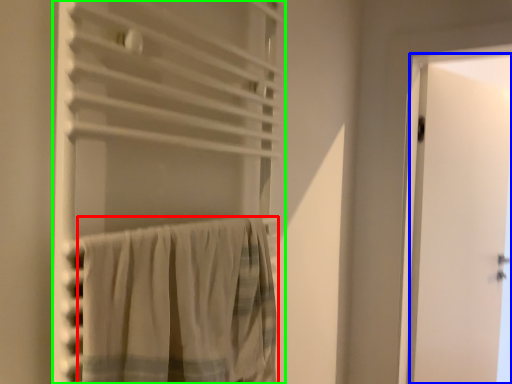
Question: Which is nearer to the curtain (highlighted by a red box)? door (highlighted by a blue box) or curtain (highlighted by a green box).

Choices:
 (A) door
 (B) curtain

Answer: (B)